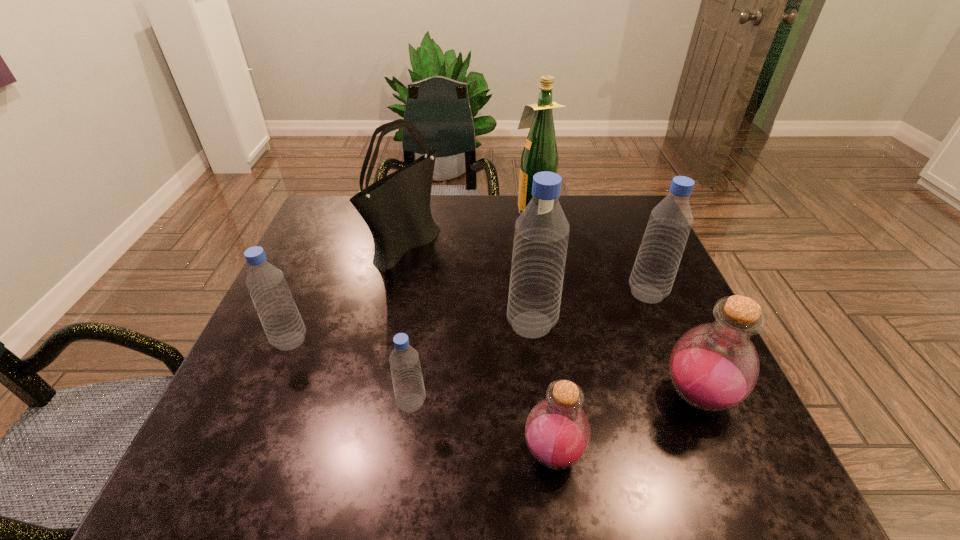
Identify the location of vacant space at the near left corner of the desktop. (269, 442).

Identify the location of blank space at the far right corner of the desktop. (626, 212).

Where is `free space at the near right corner`? free space at the near right corner is located at coordinates (664, 446).

Find the location of `vacant area that lies between the leftmost blue bottle and the second tallest bottle`. vacant area that lies between the leftmost blue bottle and the second tallest bottle is located at coordinates (468, 318).

At what (x,y) coordinates should I click in order to perform the action: click on vacant region between the leftmost bottle and the nearest blue bottle. Please return your answer as a coordinate pair (x, y). The height and width of the screenshot is (540, 960). Looking at the image, I should click on [350, 372].

Where is `free spot between the fifth bottle from right to left and the shoulder bag`? free spot between the fifth bottle from right to left and the shoulder bag is located at coordinates (409, 322).

This screenshot has width=960, height=540. I want to click on vacant space that is in between the tallest bottle and the smaller purple bottle, so click(542, 389).

Where is `free space between the leftmost bottle and the biggest blue bottle`? The width and height of the screenshot is (960, 540). free space between the leftmost bottle and the biggest blue bottle is located at coordinates (411, 333).

This screenshot has width=960, height=540. I want to click on empty location between the smaller purple bottle and the right purple bottle, so [x=625, y=425].

At what (x,y) coordinates should I click in order to perform the action: click on empty space between the liquor and the shoulder bag. Please return your answer as a coordinate pair (x, y). Looking at the image, I should click on (469, 226).